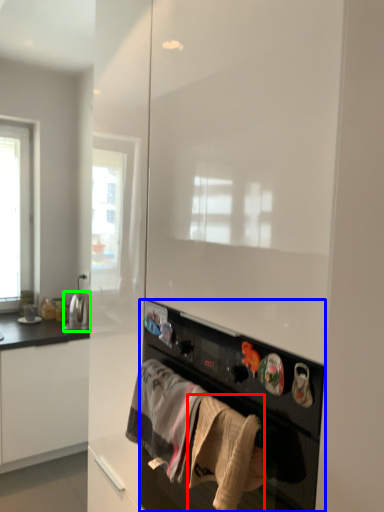
Question: Which object is the closest to the clothing (highlighted by a red box)? Choose among these: home appliance (highlighted by a blue box) or appliance (highlighted by a green box).

Choices:
 (A) home appliance
 (B) appliance

Answer: (A)